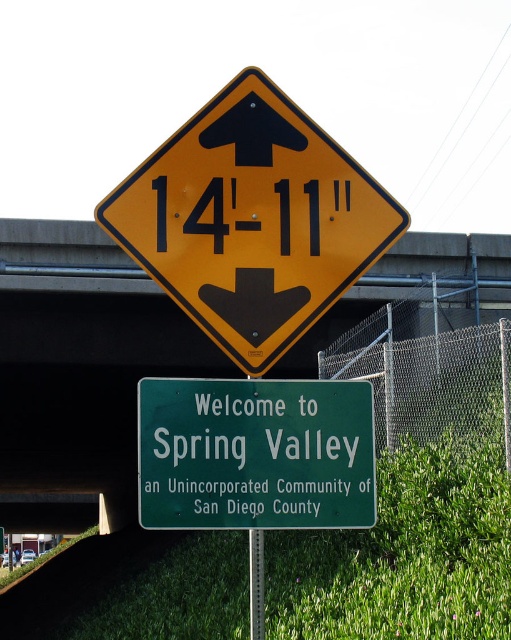
You are driving a truck that is 14 feet 11 inches tall and need to pass under the bridge. The truck is currently stopped at the green matte signboard at center. Can you safely drive forward under the brushed metal overpass at upper center without hitting the overpass?

The height restriction sign indicates a maximum height of 14 feet 11 inches. Since your truck is exactly 14 feet 11 inches tall, it is at the limit. However, the brushed metal overpass at upper center is 18.35 feet away from the green matte signboard at center. To safely pass under, you must ensure there is enough clearance not only in height but also that the distance allows for proper maneuvering. However, the height matches exactly, so there is a risk of scraping or hitting the overpass. It is advisable,

You are driving a truck that is 14 feet 11 inches tall. You see the brushed metal overpass at upper center ahead. According to the sign, will your truck fit under it?

The top sign indicates a height restriction of 14 feet 11 inches. Since your truck is exactly 14 feet 11 inches tall, it may fit, but there is no clearance. Proceed with extreme caution.